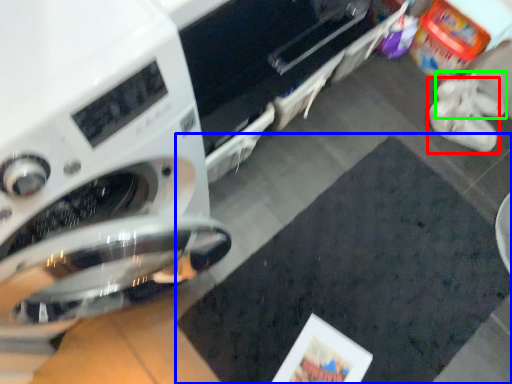
Question: Based on their relative distances, which object is nearer to footwear (highlighted by a red box)? Choose from mat (highlighted by a blue box) and shoe (highlighted by a green box).

Choices:
 (A) mat
 (B) shoe

Answer: (B)